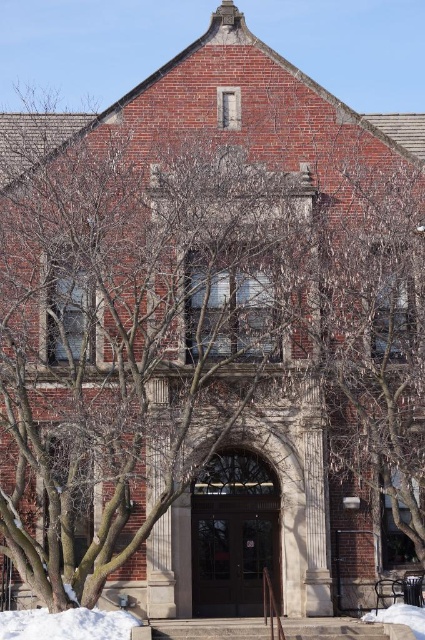
Question: Which point appears farthest from the camera in this image?

Choices:
 (A) pyautogui.click(x=387, y=618)
 (B) pyautogui.click(x=36, y=625)

Answer: (A)

Question: Which point is closer to the camera?

Choices:
 (A) white powdery snow at lower left
 (B) white fluffy snow at lower right

Answer: (A)

Question: Is white powdery snow at lower left to the left of white fluffy snow at lower right from the viewer's perspective?

Choices:
 (A) yes
 (B) no

Answer: (A)

Question: Does white powdery snow at lower left appear on the left side of white fluffy snow at lower right?

Choices:
 (A) yes
 (B) no

Answer: (A)

Question: Is the position of white powdery snow at lower left less distant than that of white fluffy snow at lower right?

Choices:
 (A) no
 (B) yes

Answer: (B)

Question: Which of the following is the farthest from the observer?

Choices:
 (A) (45, 621)
 (B) (418, 637)

Answer: (B)